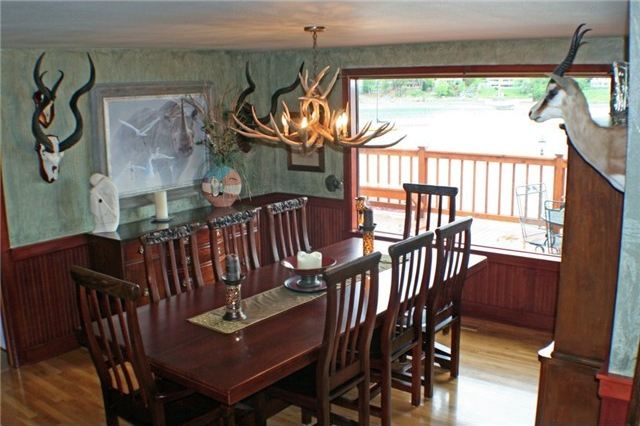
Identify the location of framed picture. This screenshot has height=426, width=640. (173, 126).